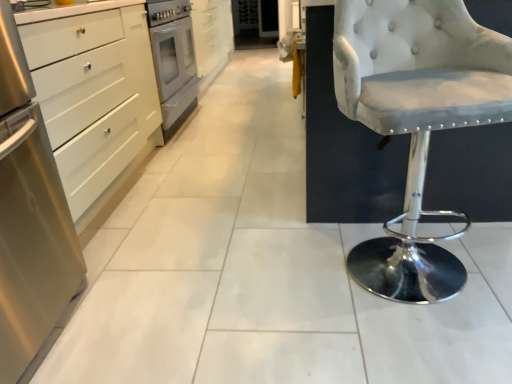
Question: Does stainless steel oven at center-left appear on the left side of white glossy cabinet at upper left, placed as the first cabinetry when sorted from top to bottom?

Choices:
 (A) no
 (B) yes

Answer: (B)

Question: From a real-world perspective, is stainless steel oven at center-left below white glossy cabinet at upper left, the 1th cabinetry from the right?

Choices:
 (A) yes
 (B) no

Answer: (B)

Question: Are stainless steel oven at center-left and white glossy cabinet at upper left, the second cabinetry when ordered from bottom to top, beside each other?

Choices:
 (A) yes
 (B) no

Answer: (B)

Question: Would you say stainless steel oven at center-left is outside white glossy cabinet at upper left, the second cabinetry positioned from the left?

Choices:
 (A) no
 (B) yes

Answer: (B)

Question: Is stainless steel oven at center-left far away from white glossy cabinet at upper left, which is the first cabinetry in back-to-front order?

Choices:
 (A) no
 (B) yes

Answer: (A)

Question: Is white tufted fabric stool at right inside or outside of white glossy cabinet at upper left, which is the first cabinetry in back-to-front order?

Choices:
 (A) outside
 (B) inside

Answer: (A)

Question: Looking at the image, does white tufted fabric stool at right seem bigger or smaller compared to white glossy cabinet at upper left, the second cabinetry positioned from the left?

Choices:
 (A) small
 (B) big

Answer: (B)

Question: Considering the positions of white tufted fabric stool at right and white glossy cabinet at upper left, the second cabinetry when ordered from bottom to top, in the image, is white tufted fabric stool at right taller or shorter than white glossy cabinet at upper left, the second cabinetry when ordered from bottom to top,?

Choices:
 (A) short
 (B) tall

Answer: (B)

Question: In the image, is white tufted fabric stool at right positioned in front of or behind white glossy cabinet at upper left, placed as the first cabinetry when sorted from top to bottom?

Choices:
 (A) front
 (B) behind

Answer: (A)

Question: Is stainless steel cabinet at left, which appears as the first cabinetry when ordered from the bottom, to the left or to the right of white tufted fabric stool at right in the image?

Choices:
 (A) right
 (B) left

Answer: (B)

Question: Is stainless steel cabinet at left, which appears as the first cabinetry when ordered from the bottom, in front of or behind white tufted fabric stool at right in the image?

Choices:
 (A) behind
 (B) front

Answer: (A)

Question: Which is correct: stainless steel cabinet at left, which appears as the first cabinetry when ordered from the bottom, is inside white tufted fabric stool at right, or outside of it?

Choices:
 (A) outside
 (B) inside

Answer: (A)

Question: From a real-world perspective, is stainless steel cabinet at left, the 2th cabinetry in the right-to-left sequence, physically located above or below white tufted fabric stool at right?

Choices:
 (A) above
 (B) below

Answer: (B)

Question: Choose the correct answer: Is stainless steel oven at center-left inside stainless steel cabinet at left, which is the second cabinetry in top-to-bottom order, or outside it?

Choices:
 (A) inside
 (B) outside

Answer: (B)

Question: Considering the positions of stainless steel oven at center-left and stainless steel cabinet at left, which is the second cabinetry in top-to-bottom order, in the image, is stainless steel oven at center-left wider or thinner than stainless steel cabinet at left, which is the second cabinetry in top-to-bottom order,?

Choices:
 (A) wide
 (B) thin

Answer: (B)